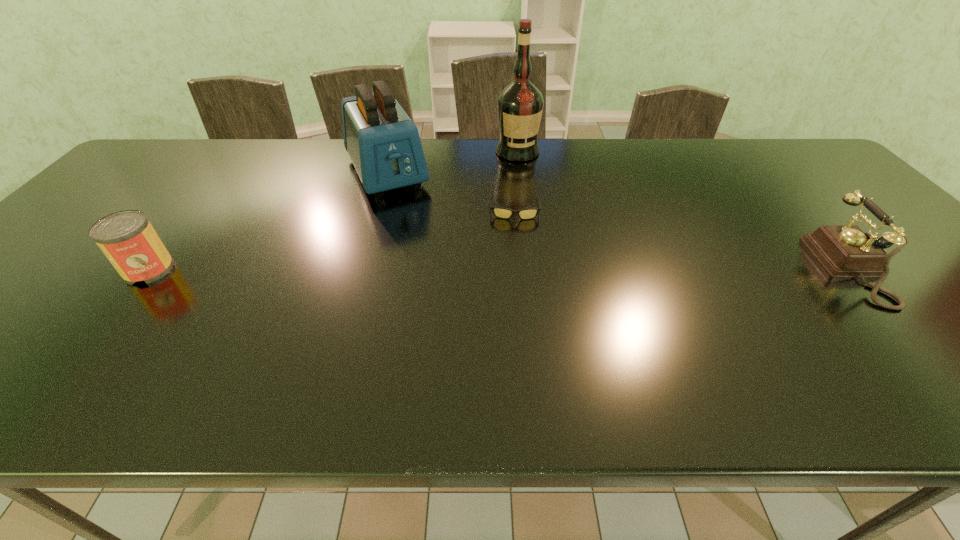
Find the location of a particular element. The width and height of the screenshot is (960, 540). vacant space located 0.310m on the front-facing side of the toaster is located at coordinates (436, 269).

This screenshot has height=540, width=960. I want to click on free spot located 0.370m on the surface of the liquor, so click(555, 234).

Locate an element on the screen. blank space located 0.180m on the surface of the liquor is located at coordinates (537, 194).

Where is `vacant space located 0.200m on the surface of the liquor`? vacant space located 0.200m on the surface of the liquor is located at coordinates (538, 198).

Locate an element on the screen. The height and width of the screenshot is (540, 960). vacant area situated 0.290m on the front-facing side of the sunglasses is located at coordinates (517, 301).

Find the location of a particular element. The width and height of the screenshot is (960, 540). vacant space positioned on the front-facing side of the sunglasses is located at coordinates (516, 238).

Identify the location of free space located 0.140m on the front-facing side of the sunglasses. The image size is (960, 540). (516, 256).

Where is `toaster located at the far edge`? This screenshot has height=540, width=960. toaster located at the far edge is located at coordinates (384, 145).

Locate an element on the screen. The width and height of the screenshot is (960, 540). liquor that is at the far edge is located at coordinates (520, 104).

Locate an element on the screen. The height and width of the screenshot is (540, 960). object that is at the right edge is located at coordinates (844, 251).